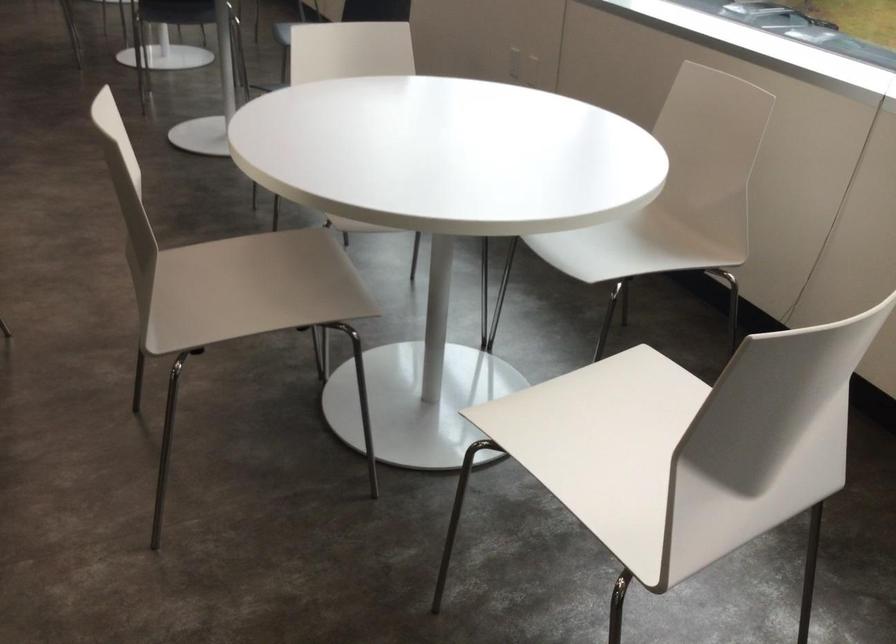
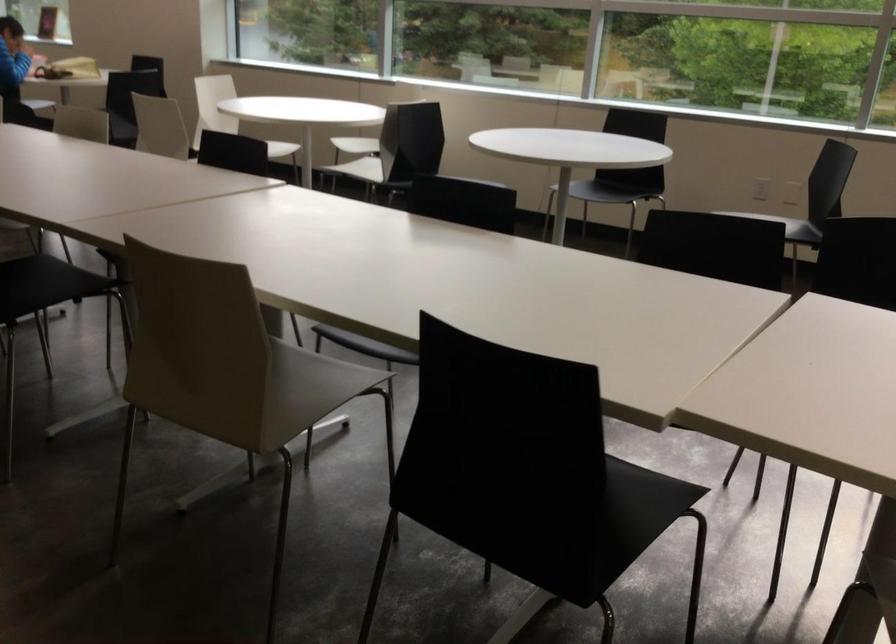
Question: In a continuous first-person perspective shot, in which direction is the camera moving?

Choices:
 (A) Left
 (B) Right
 (C) Forward
 (D) Backward

Answer: (A)